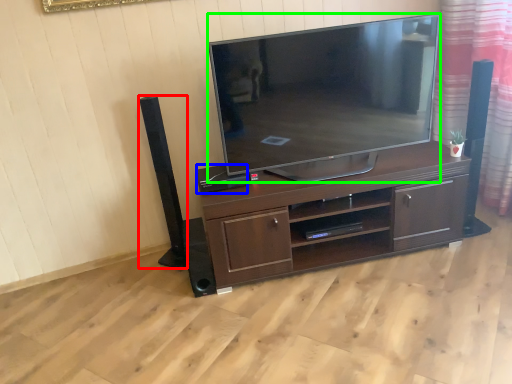
Question: Which is farther away from speaker (highlighted by a red box)? speaker (highlighted by a blue box) or television (highlighted by a green box)?

Choices:
 (A) speaker
 (B) television

Answer: (B)